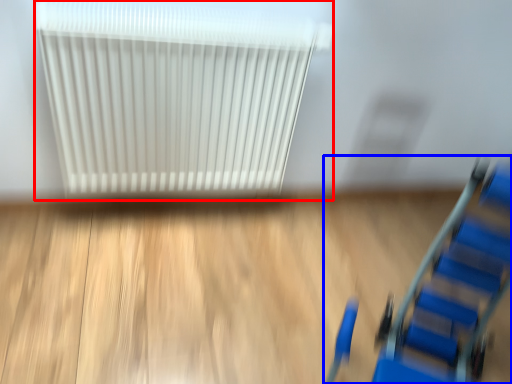
Question: Which of the following is the closest to the observer, radiator (highlighted by a red box) or furniture (highlighted by a blue box)?

Choices:
 (A) radiator
 (B) furniture

Answer: (B)